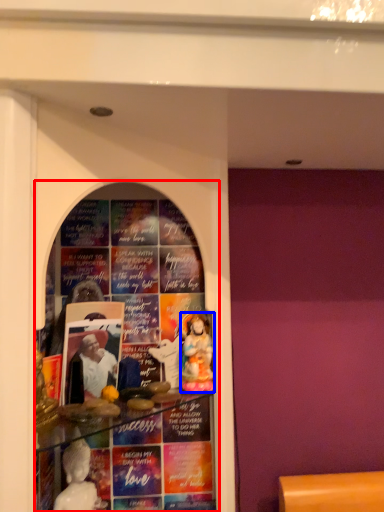
Question: Which point is further to the camera, shop window (highlighted by a red box) or person (highlighted by a blue box)?

Choices:
 (A) shop window
 (B) person

Answer: (B)